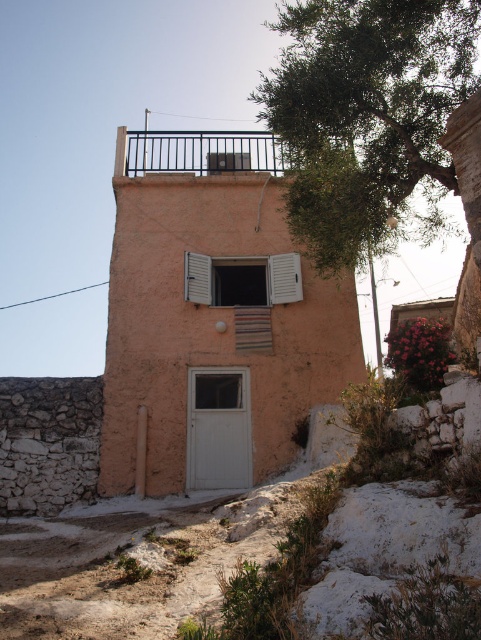
Looking at this image, you are standing in front of the building and want to place a 3.5 meter long ladder between the green leafy tree at upper right and the wooden at center. Is there enough space?

The distance between the green leafy tree at upper right and the wooden at center is 2.87 meters, which is shorter than the ladder length of 3.5 meters. Therefore, there is not enough space to place the ladder between them.

You are standing in front of the building and want to place a small package on the wooden at center. However, you notice the white matte shutter at center might block access. Can you place the package there without moving the shutter?

The wooden at center is positioned under the white matte shutter at center, so placing the package there would require moving the shutter to avoid obstruction.

You are a painter who needs to decide which object to paint first based on their size. You have to choose between the green leafy tree at upper right and the wooden at center. According to their widths, which object should you paint first?

The green leafy tree at upper right has a greater width than the wooden at center, so you should paint the green leafy tree at upper right first.